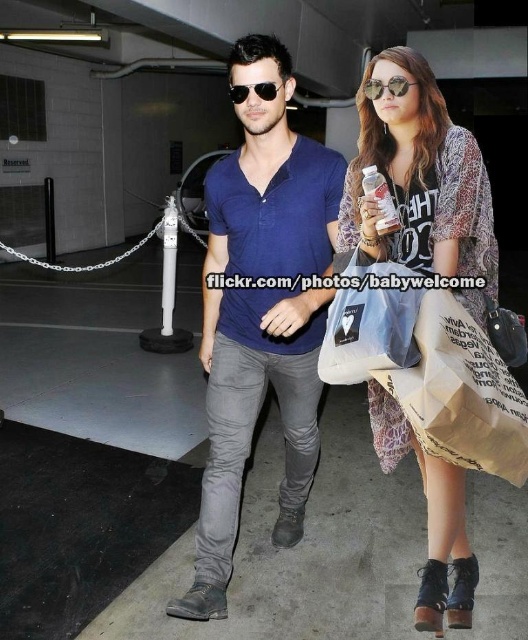
Question: Among these objects, which one is farthest from the camera?

Choices:
 (A) brown suede boot at lower right
 (B) shiny silver sunglasses at center

Answer: (A)

Question: Is brown suede boot at lower right to the left of leather boot at lower right from the viewer's perspective?

Choices:
 (A) yes
 (B) no

Answer: (A)

Question: Where is printed chiffon dress at center located in relation to shiny gold sunglasses at upper center in the image?

Choices:
 (A) right
 (B) left

Answer: (A)

Question: Does matte blue shirt at center appear on the left side of white paper bag at lower right?

Choices:
 (A) no
 (B) yes

Answer: (B)

Question: Which of these objects is positioned farthest from the shiny silver sunglasses at center?

Choices:
 (A) white paper bag at lower right
 (B) printed chiffon dress at center
 (C) shiny gold sunglasses at upper center
 (D) clear plastic bottle at center

Answer: (A)

Question: Which of these objects is positioned closest to the leather boot at lower right?

Choices:
 (A) printed chiffon dress at center
 (B) shiny gold sunglasses at upper center

Answer: (A)